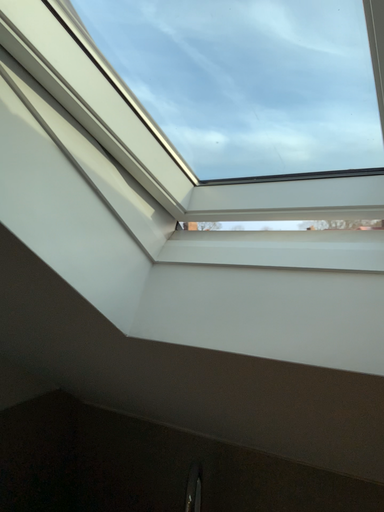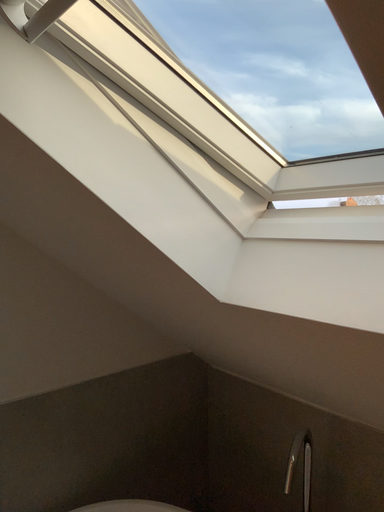
Question: Which way did the camera rotate in the video?

Choices:
 (A) rotated right
 (B) rotated left

Answer: (B)